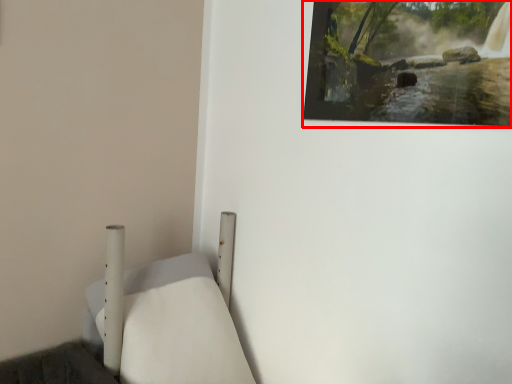
Question: From the image, what is the correct spatial relationship of picture frame (annotated by the red box) in relation to furniture?

Choices:
 (A) right
 (B) left

Answer: (A)